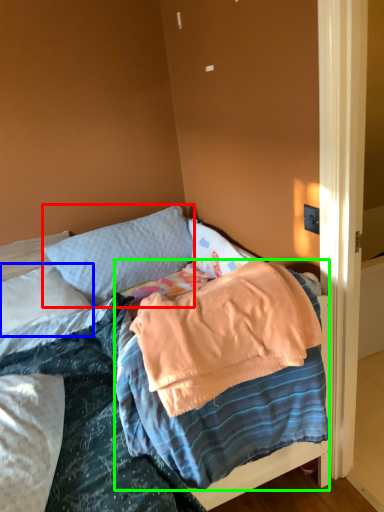
Question: Which is farther away from pillow (highlighted by a red box)? pillow (highlighted by a blue box) or blanket (highlighted by a green box)?

Choices:
 (A) pillow
 (B) blanket

Answer: (B)